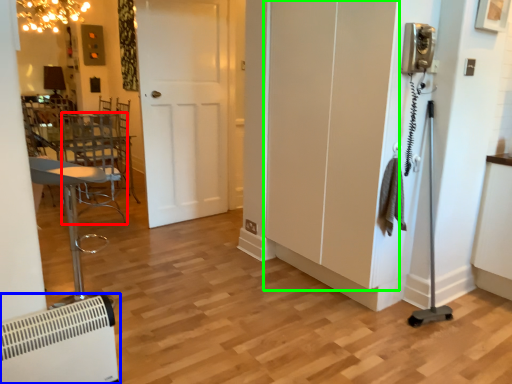
Question: Considering the real-world distances, which object is farthest from swivel chair (highlighted by a red box)? air conditioning (highlighted by a blue box) or screen door (highlighted by a green box)?

Choices:
 (A) air conditioning
 (B) screen door

Answer: (A)